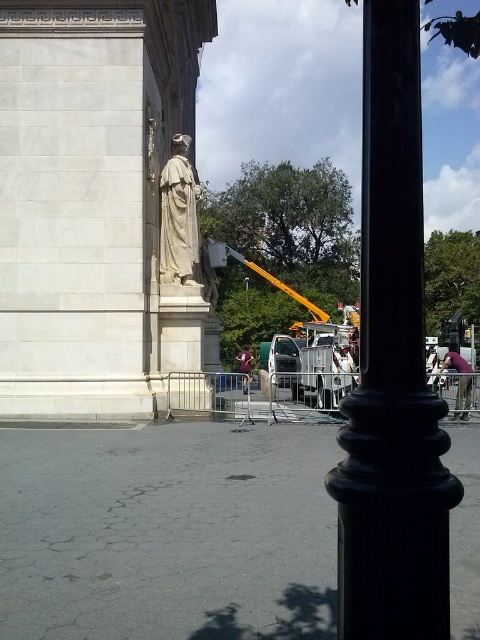
You are a photographer standing in front of the historical monument. You notice the white stone statue at center and the green fabric jacket at center. Which object is positioned higher in the scene?

The white stone statue at center is above the green fabric jacket at center, so the white stone statue at center is positioned higher in the scene.

You are a city planner reviewing the layout of this urban space. You need to determine if the black polished pole at center can be moved to allow a better view of the white stone statue at center. Based on their current positions, is the pole blocking the statue?

The black polished pole at center is positioned over white stone statue at center, meaning it is directly above and blocking the statue, so yes, moving the pole would improve the statue visibility.

You are a photographer planning to capture the white stone statue at center and the matte black jacket at lower right in a single frame. Given that your camera has a fixed focal length, which object should you position closer to the center of the frame to ensure both are fully visible without cropping?

The white stone statue at center is wider than the matte black jacket at lower right. To ensure both are fully visible without cropping, you should position the white stone statue at center closer to the center of the frame since it is wider and requires more space in the composition.